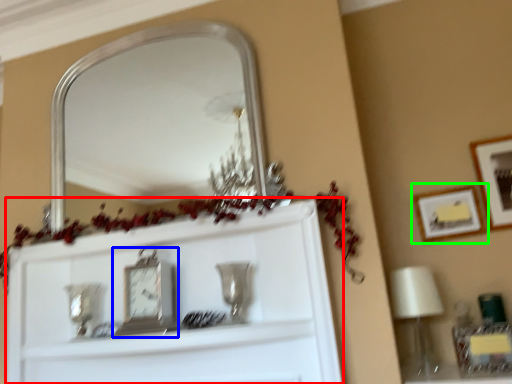
Question: Which is nearer to the cabinet (highlighted by a red box)? clock (highlighted by a blue box) or picture frame (highlighted by a green box).

Choices:
 (A) clock
 (B) picture frame

Answer: (A)